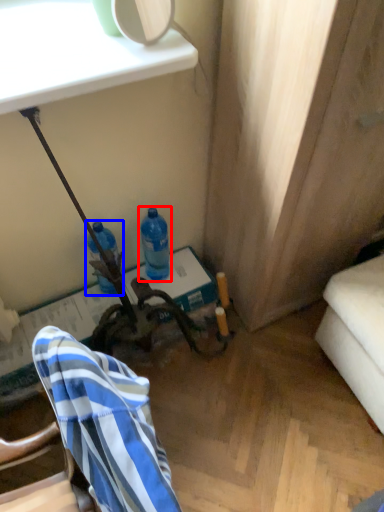
Question: Which object appears closest to the camera in this image, bottle (highlighted by a red box) or bottle (highlighted by a blue box)?

Choices:
 (A) bottle
 (B) bottle

Answer: (B)